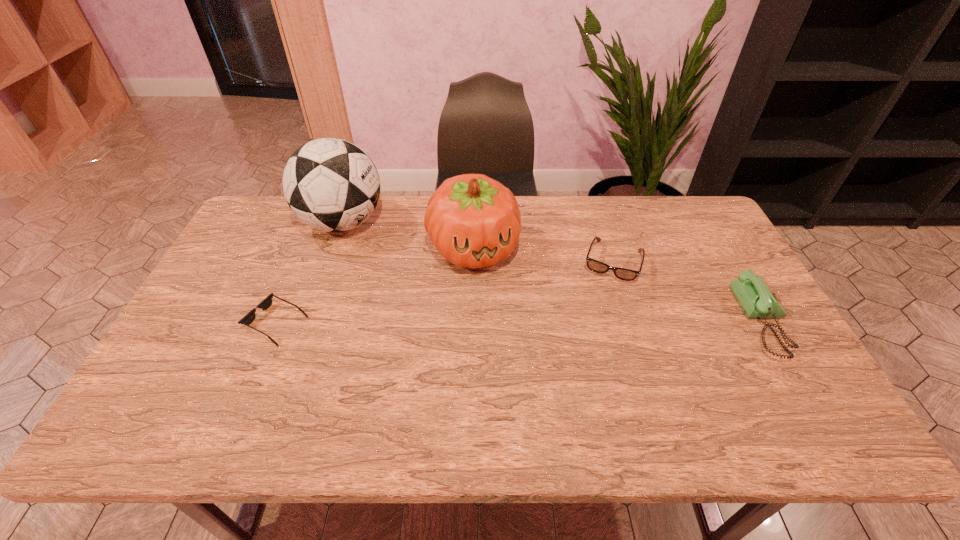
Identify the location of free space located on the lenses of the second shortest object. (591, 329).

Identify the location of vacant region located on the lenses of the second shortest object. (591, 329).

Locate an element on the screen. blank area located 0.300m on the lenses of the second shortest object is located at coordinates (581, 364).

This screenshot has width=960, height=540. Identify the location of free spot located 0.310m on the side of the pumpkin with the cute face. (515, 366).

Where is `vacant position located on the side of the pumpkin with the cute face`? The width and height of the screenshot is (960, 540). vacant position located on the side of the pumpkin with the cute face is located at coordinates (x=521, y=383).

You are a GUI agent. You are given a task and a screenshot of the screen. Output one action in this format:
    pyautogui.click(x=<x>, y=<y>)
    Task: Click on the vacant space located 0.110m on the side of the pumpkin with the cute face
    
    Given the screenshot: What is the action you would take?
    pyautogui.click(x=493, y=307)

What are the coordinates of `free location located on the surface of the soccer ball where the brand logo is visible` in the screenshot? It's located at (392, 265).

Where is `vacant area situated 0.050m on the surface of the soccer ball where the brand logo is visible`? Image resolution: width=960 pixels, height=540 pixels. vacant area situated 0.050m on the surface of the soccer ball where the brand logo is visible is located at coordinates (375, 251).

You are a GUI agent. You are given a task and a screenshot of the screen. Output one action in this format:
    pyautogui.click(x=<x>, y=<y>)
    Task: Click on the free space located 0.060m on the surface of the soccer ball where the brand logo is visible
    
    Given the screenshot: What is the action you would take?
    pyautogui.click(x=377, y=252)

The width and height of the screenshot is (960, 540). I want to click on pumpkin located at the far edge, so click(474, 221).